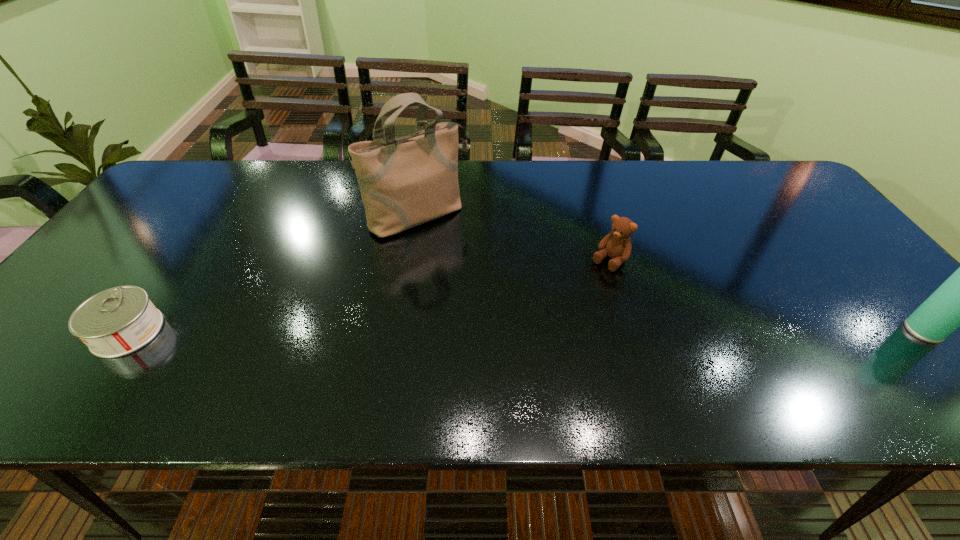
At what (x,y) coordinates should I click in order to perform the action: click on free space located on the face of the third nearest object. Please return your answer as a coordinate pair (x, y). Looking at the image, I should click on (531, 341).

The image size is (960, 540). I want to click on free space located 0.160m on the face of the third nearest object, so click(x=564, y=307).

What are the coordinates of `free space located on the face of the third nearest object` in the screenshot? It's located at (576, 295).

What are the coordinates of `vacant space positioned 0.110m on the front-facing side of the tallest object` in the screenshot? It's located at (467, 259).

At what (x,y) coordinates should I click in order to perform the action: click on vacant space positioned 0.290m on the front-facing side of the tallest object. Please return your answer as a coordinate pair (x, y). Looking at the image, I should click on click(509, 301).

Locate an element on the screen. vacant space positioned 0.330m on the front-facing side of the tallest object is located at coordinates (519, 312).

You are a GUI agent. You are given a task and a screenshot of the screen. Output one action in this format:
    pyautogui.click(x=<x>, y=<y>)
    Task: Click on the object located in the far edge section of the desktop
    
    Given the screenshot: What is the action you would take?
    pyautogui.click(x=404, y=182)

Find the location of a particular element. can that is positioned at the near edge is located at coordinates (118, 321).

Locate an element on the screen. Image resolution: width=960 pixels, height=540 pixels. thermos bottle that is at the near edge is located at coordinates (959, 302).

Locate an element on the screen. The image size is (960, 540). object located at the left edge is located at coordinates (118, 321).